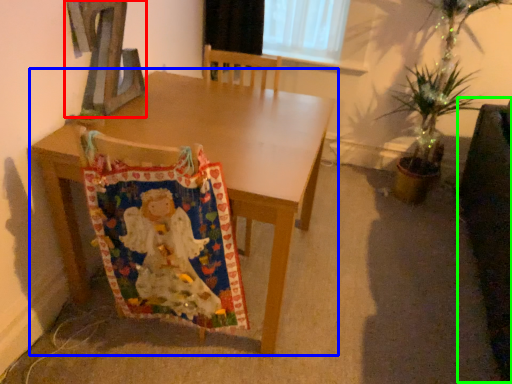
Question: Which object is positioned farthest from alphabet (highlighted by a red box)? Select from table (highlighted by a blue box) and swivel chair (highlighted by a green box).

Choices:
 (A) table
 (B) swivel chair

Answer: (B)